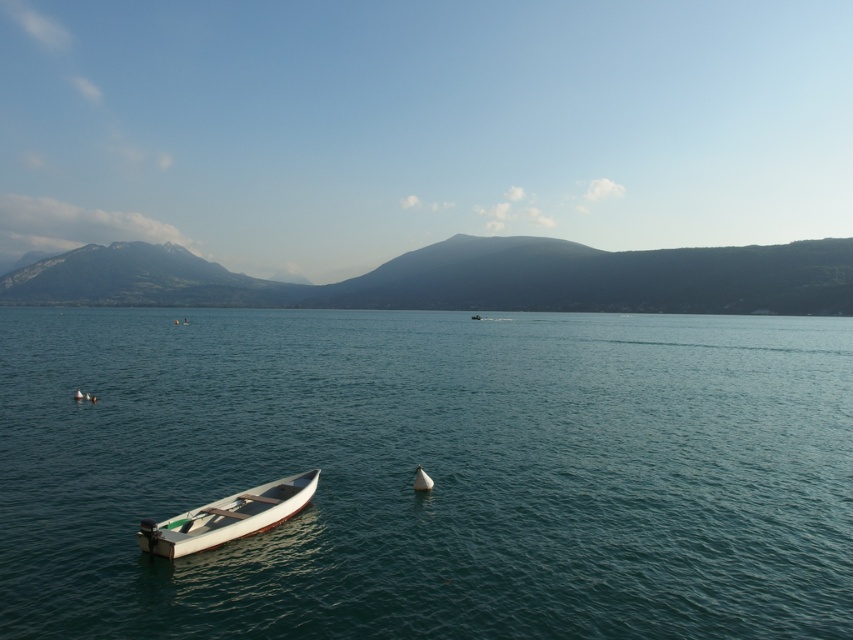
Is the position of green textured mountain at center less distant than that of white matte boat at lower left?

No, green textured mountain at center is further to the viewer.

Who is more forward, (651, 307) or (315, 468)?

Point (315, 468) is more forward.

Who is more forward, (x=16, y=291) or (x=233, y=509)?

Point (x=233, y=509)

At what (x,y) coordinates should I click in order to perform the action: click on green textured mountain at center. Please return your answer as a coordinate pair (x, y). Looking at the image, I should click on pos(468,278).

Can you confirm if green smooth water at center is positioned to the right of white matte sailboat at center?

Yes, green smooth water at center is to the right of white matte sailboat at center.

The image size is (853, 640). What are the coordinates of `green smooth water at center` in the screenshot? It's located at (428, 474).

Identify the location of green smooth water at center. (428, 474).

Consider the image. Can you confirm if green textured mountain at center is bigger than white matte boat at center?

Indeed, green textured mountain at center has a larger size compared to white matte boat at center.

Does green textured mountain at center have a smaller size compared to white matte boat at center?

No, green textured mountain at center is not smaller than white matte boat at center.

At what (x,y) coordinates should I click in order to perform the action: click on green textured mountain at center. Please return your answer as a coordinate pair (x, y). Looking at the image, I should click on (468, 278).

This screenshot has height=640, width=853. I want to click on green textured mountain at center, so click(x=468, y=278).